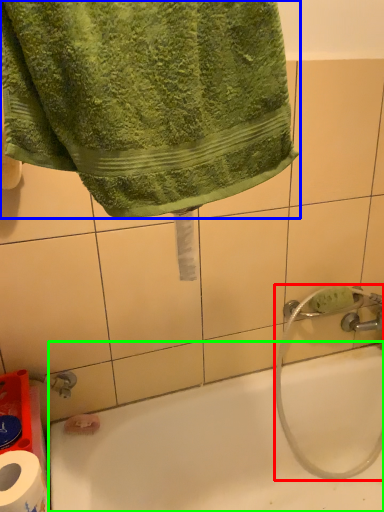
Question: Based on their relative distances, which object is farther from garden hose (highlighted by a red box)? Choose from towel (highlighted by a blue box) and bathtub (highlighted by a green box).

Choices:
 (A) towel
 (B) bathtub

Answer: (A)